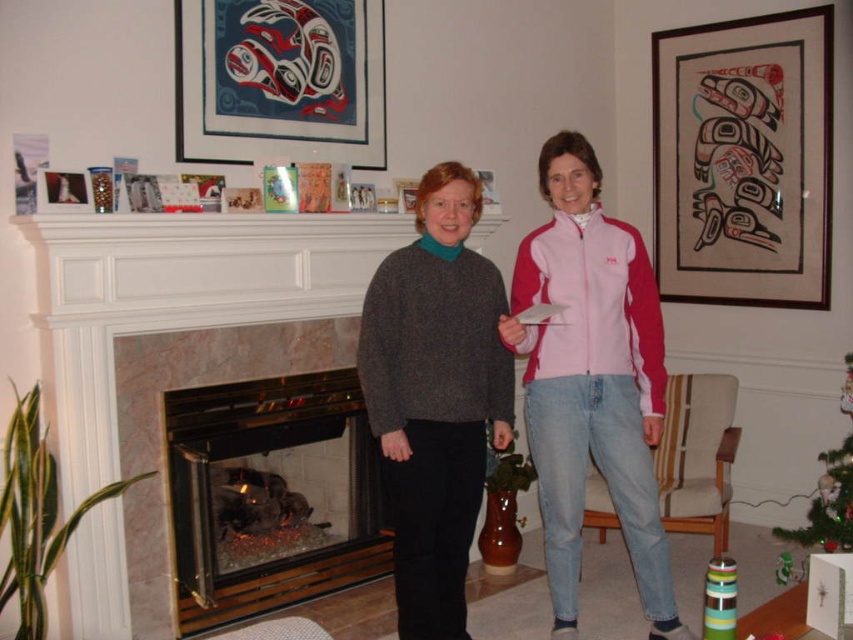
You are a delivery person who needs to place a small package between the pink fleece jacket at center and the matte plastic picture frame at upper center. The package is 1.2 meters long. Will it fit in the space between them?

The distance between the pink fleece jacket at center and the matte plastic picture frame at upper center is 1.43 meters. Since the package is 1.2 meters long, it will fit in the space between them.

You are an interior designer assessing the living room layout. You need to determine if the knitted gray sweater at center can be safely placed on the wooden fireplace at center without obstructing the view of the framed artwork on the mantel. Based on their positions, is this possible?

The knitted gray sweater at center is currently above the wooden fireplace at center. Since the sweater is positioned above the fireplace, placing it on the mantel would not obstruct the view of the framed artwork as it can be placed alongside or below the existing decorations.